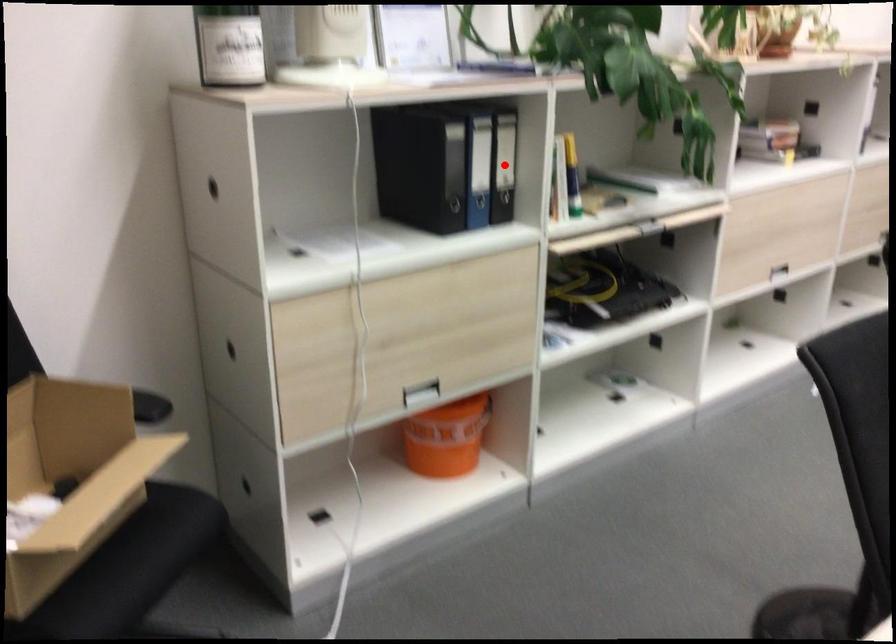
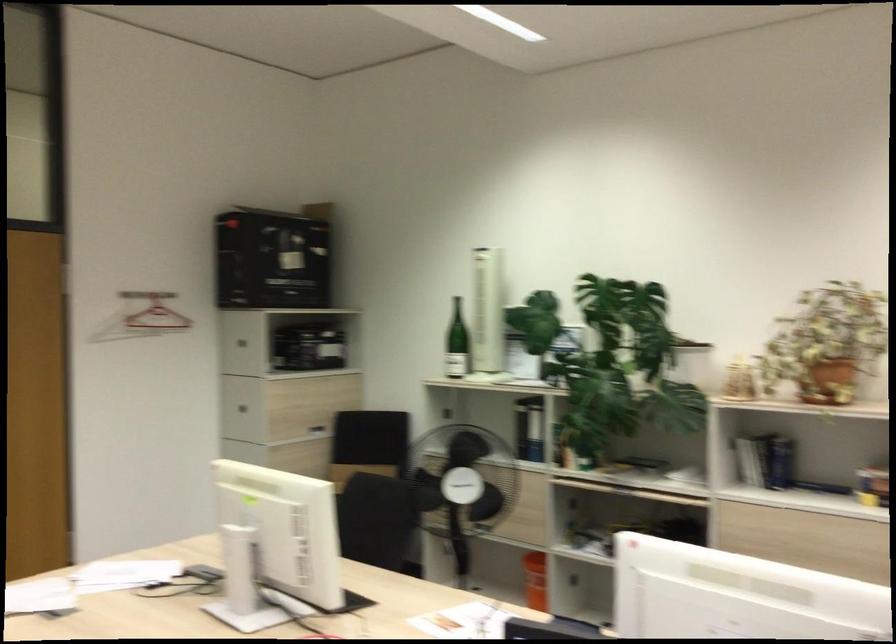
Question: I am providing you with two images of the same scene from different viewpoints. A red point is marked on the first image. Is the red point's position out of view in image 2?

Choices:
 (A) Yes
 (B) No

Answer: (A)